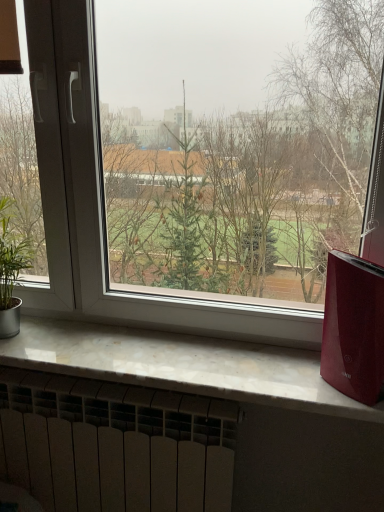
Where is `free space above white marble window sill at lower center (from a real-world perspective)`? free space above white marble window sill at lower center (from a real-world perspective) is located at coordinates click(x=141, y=349).